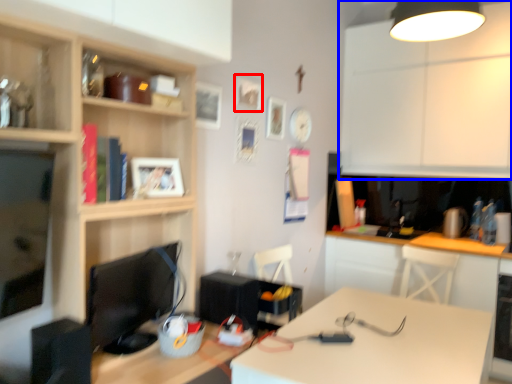
Question: Which of the following is the closest to the observer, picture frame (highlighted by a red box) or cabinetry (highlighted by a blue box)?

Choices:
 (A) picture frame
 (B) cabinetry

Answer: (A)